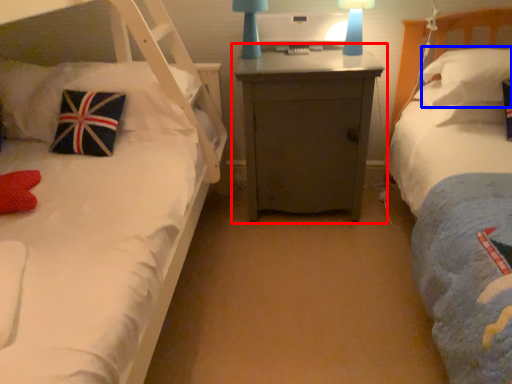
Question: Among these objects, which one is farthest to the camera, nightstand (highlighted by a red box) or pillow (highlighted by a blue box)?

Choices:
 (A) nightstand
 (B) pillow

Answer: (A)